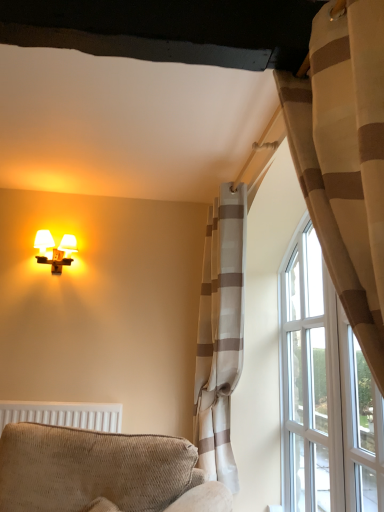
Question: Should I look upward or downward to see textured beige armchair at lower left?

Choices:
 (A) up
 (B) down

Answer: (B)

Question: Is white textured radiator at lower left not near beige striped curtain at right, arranged as the second curtain when viewed from the back?

Choices:
 (A) yes
 (B) no

Answer: (A)

Question: Is white textured radiator at lower left positioned beyond the bounds of beige striped curtain at right, arranged as the first curtain when viewed from the front?

Choices:
 (A) no
 (B) yes

Answer: (B)

Question: Does white textured radiator at lower left have a lesser width compared to beige striped curtain at right, arranged as the second curtain when viewed from the back?

Choices:
 (A) yes
 (B) no

Answer: (A)

Question: Is beige striped curtain at right, arranged as the second curtain when viewed from the back, completely or partially inside white textured radiator at lower left?

Choices:
 (A) yes
 (B) no

Answer: (B)

Question: Can you confirm if white textured radiator at lower left is shorter than beige striped curtain at right, arranged as the second curtain when viewed from the back?

Choices:
 (A) no
 (B) yes

Answer: (B)

Question: Does white textured radiator at lower left appear on the left side of beige striped curtain at right, arranged as the second curtain when viewed from the back?

Choices:
 (A) no
 (B) yes

Answer: (B)

Question: Can you confirm if beige striped curtain at right, arranged as the second curtain when viewed from the back, is smaller than matte white wall sconce at upper left?

Choices:
 (A) no
 (B) yes

Answer: (A)

Question: Considering the relative positions of beige striped curtain at right, arranged as the second curtain when viewed from the back, and matte white wall sconce at upper left in the image provided, is beige striped curtain at right, arranged as the second curtain when viewed from the back, behind matte white wall sconce at upper left?

Choices:
 (A) no
 (B) yes

Answer: (A)

Question: Considering the relative sizes of beige striped curtain at right, arranged as the second curtain when viewed from the back, and matte white wall sconce at upper left in the image provided, is beige striped curtain at right, arranged as the second curtain when viewed from the back, wider than matte white wall sconce at upper left?

Choices:
 (A) yes
 (B) no

Answer: (A)

Question: From a real-world perspective, is beige striped curtain at right, arranged as the second curtain when viewed from the back, physically above matte white wall sconce at upper left?

Choices:
 (A) no
 (B) yes

Answer: (A)

Question: Can you confirm if beige striped curtain at right, arranged as the second curtain when viewed from the back, is taller than matte white wall sconce at upper left?

Choices:
 (A) no
 (B) yes

Answer: (B)

Question: Is beige striped curtain at right, arranged as the second curtain when viewed from the back, at the left side of matte white wall sconce at upper left?

Choices:
 (A) yes
 (B) no

Answer: (B)

Question: Is textured beige armchair at lower left shorter than light beige striped curtain at upper right, which is the 2th curtain in front-to-back order?

Choices:
 (A) yes
 (B) no

Answer: (A)